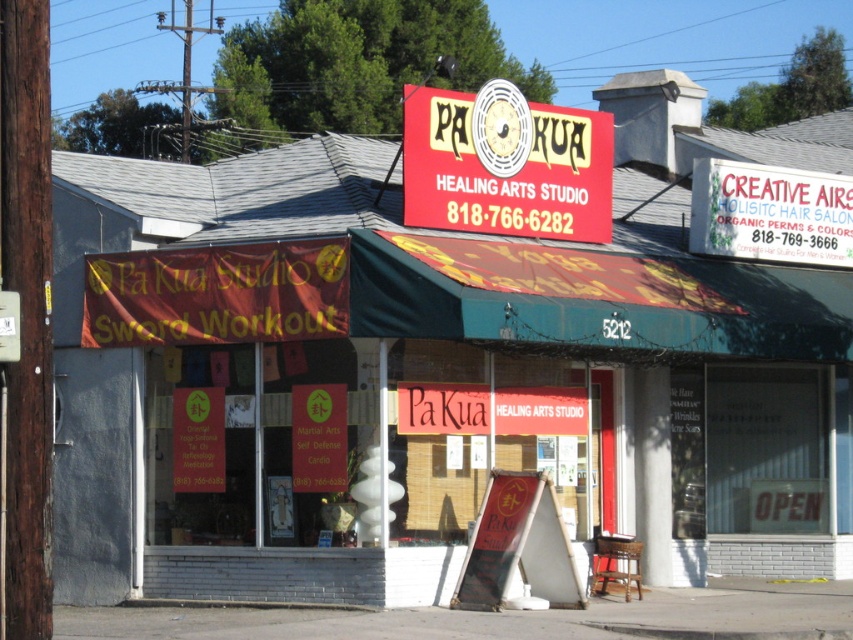
Consider the image. You are a delivery person approaching the Pa Kua Healing Arts Studio. You need to hand over a package to the staff. The package must be placed on the nearest object to you between the white plastic sign at upper right and the matte red sign at center. Which object should you place the package on?

The white plastic sign at upper right is closer to you than the matte red sign at center, so you should place the package on the white plastic sign at upper right.

You are a delivery person who needs to deliver a package to the Pa Kua Healing Arts Studio. The studio is on the left side of the frame. There is a point marked at coordinates (770, 212). What object is located at that point?

The point at coordinates (770, 212) indicates a white plastic sign at upper right.

You are a customer standing in front of the Pa Kua Healing Arts Studio. You see a red plastic sign at center and a white plastic sign at upper right. Which sign is positioned to the left?

The red plastic sign at center is positioned to the left of the white plastic sign at upper right.